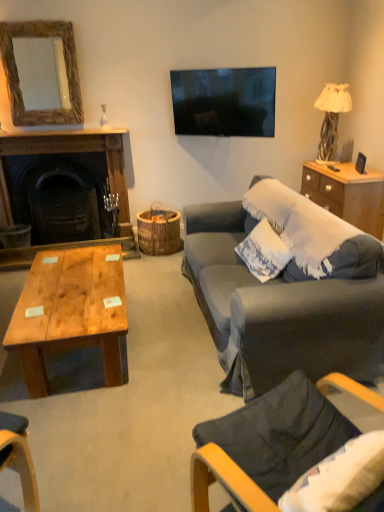
Question: Is wooden coffee table at center outside of white textured pillow at right?

Choices:
 (A) yes
 (B) no

Answer: (A)

Question: Would you say white textured pillow at right is part of wooden coffee table at center's contents?

Choices:
 (A) no
 (B) yes

Answer: (A)

Question: From a real-world perspective, is wooden coffee table at center located higher than white textured pillow at right?

Choices:
 (A) yes
 (B) no

Answer: (B)

Question: Considering the relative positions of wooden coffee table at center and white textured pillow at right in the image provided, is wooden coffee table at center to the right of white textured pillow at right from the viewer's perspective?

Choices:
 (A) yes
 (B) no

Answer: (B)

Question: Does wooden coffee table at center have a greater width compared to white textured pillow at right?

Choices:
 (A) yes
 (B) no

Answer: (A)

Question: Considering the positions of white textured pillow at right and white fabric lampshade at right in the image, is white textured pillow at right taller or shorter than white fabric lampshade at right?

Choices:
 (A) short
 (B) tall

Answer: (A)

Question: From the image's perspective, is white textured pillow at right above or below white fabric lampshade at right?

Choices:
 (A) below
 (B) above

Answer: (A)

Question: Is white textured pillow at right bigger or smaller than white fabric lampshade at right?

Choices:
 (A) small
 (B) big

Answer: (A)

Question: In the image, is white textured pillow at right positioned in front of or behind white fabric lampshade at right?

Choices:
 (A) behind
 (B) front

Answer: (B)

Question: Considering the positions of dark gray fabric chair at lower right and wooden frame mirror at upper left in the image, is dark gray fabric chair at lower right bigger or smaller than wooden frame mirror at upper left?

Choices:
 (A) small
 (B) big

Answer: (B)

Question: Is dark gray fabric chair at lower right to the left or to the right of wooden frame mirror at upper left in the image?

Choices:
 (A) right
 (B) left

Answer: (A)

Question: From the image's perspective, relative to wooden frame mirror at upper left, is dark gray fabric chair at lower right above or below?

Choices:
 (A) above
 (B) below

Answer: (B)

Question: Considering the positions of point (258, 458) and point (51, 31), is point (258, 458) closer or farther from the camera than point (51, 31)?

Choices:
 (A) farther
 (B) closer

Answer: (B)

Question: Choose the correct answer: Is dark gray fabric chair at lower right inside dark wood fireplace at left or outside it?

Choices:
 (A) outside
 (B) inside

Answer: (A)

Question: Considering their positions, is dark gray fabric chair at lower right located in front of or behind dark wood fireplace at left?

Choices:
 (A) front
 (B) behind

Answer: (A)